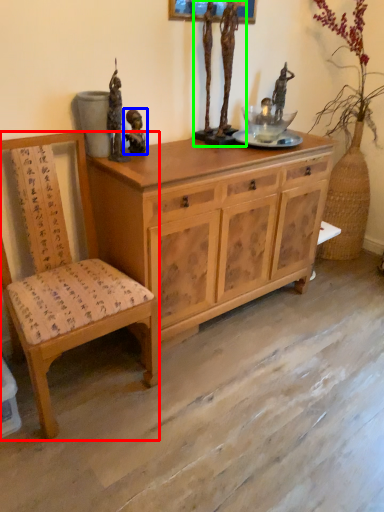
Question: Which is farther away from chair (highlighted by a red box)? person (highlighted by a blue box) or sculpture (highlighted by a green box)?

Choices:
 (A) person
 (B) sculpture

Answer: (B)